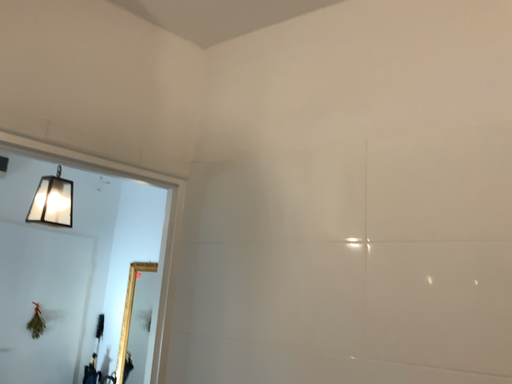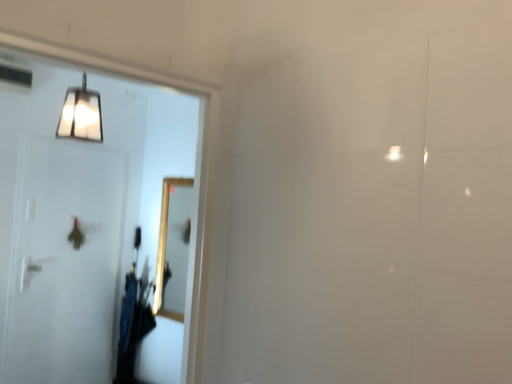
Question: Which way did the camera rotate in the video?

Choices:
 (A) rotated upward
 (B) rotated downward

Answer: (B)